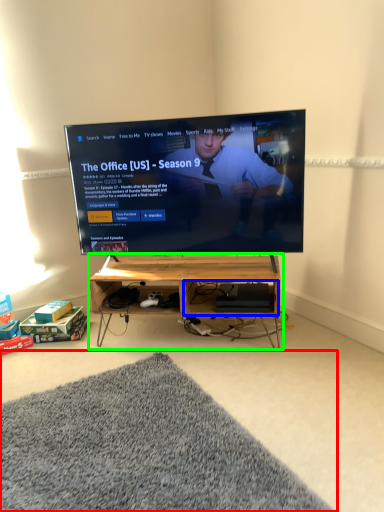
Question: Which object is positioned closest to mat (highlighted by a red box)? Select from shelf (highlighted by a blue box) and shelf (highlighted by a green box).

Choices:
 (A) shelf
 (B) shelf

Answer: (B)